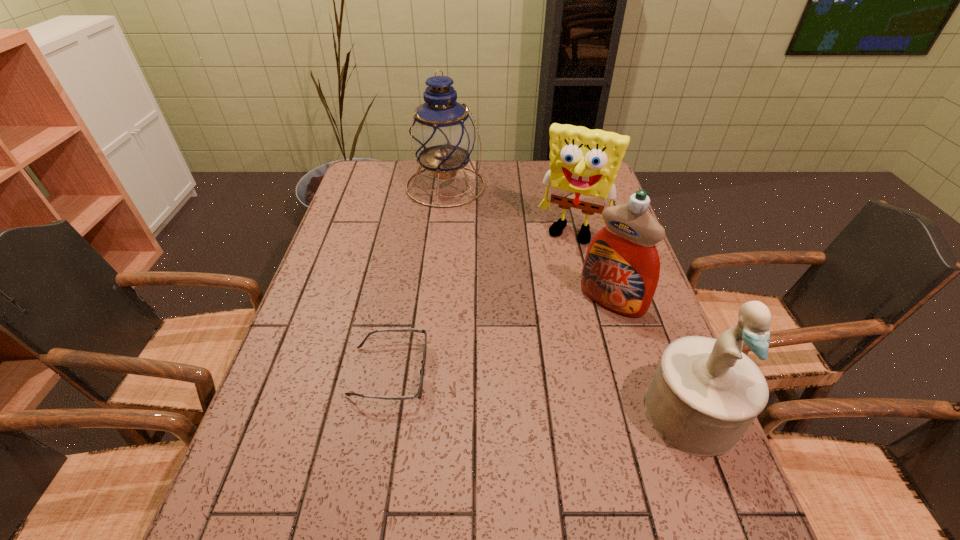
The height and width of the screenshot is (540, 960). What are the coordinates of `vacant spot on the desktop that is between the shortest object and the figurine and is positioned on the face of the fourth nearest object` in the screenshot? It's located at (501, 387).

Locate an element on the screen. This screenshot has height=540, width=960. free space on the desktop that is between the sunglasses and the figurine and is positioned on the front-facing side of the lantern is located at coordinates (579, 397).

Identify the location of free spot on the desktop that is between the sunglasses and the figurine and is positioned on the front surface of the third farthest object. This screenshot has height=540, width=960. (535, 392).